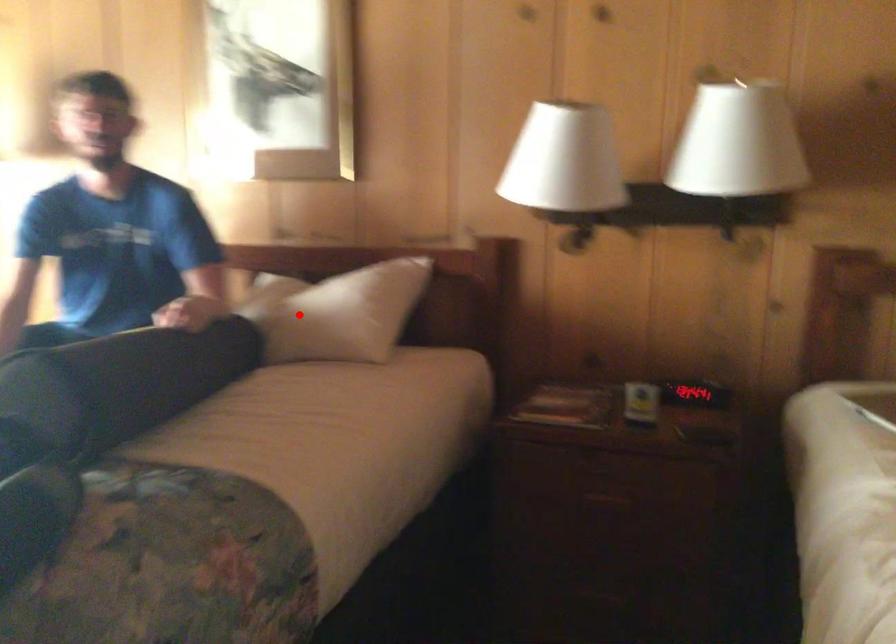
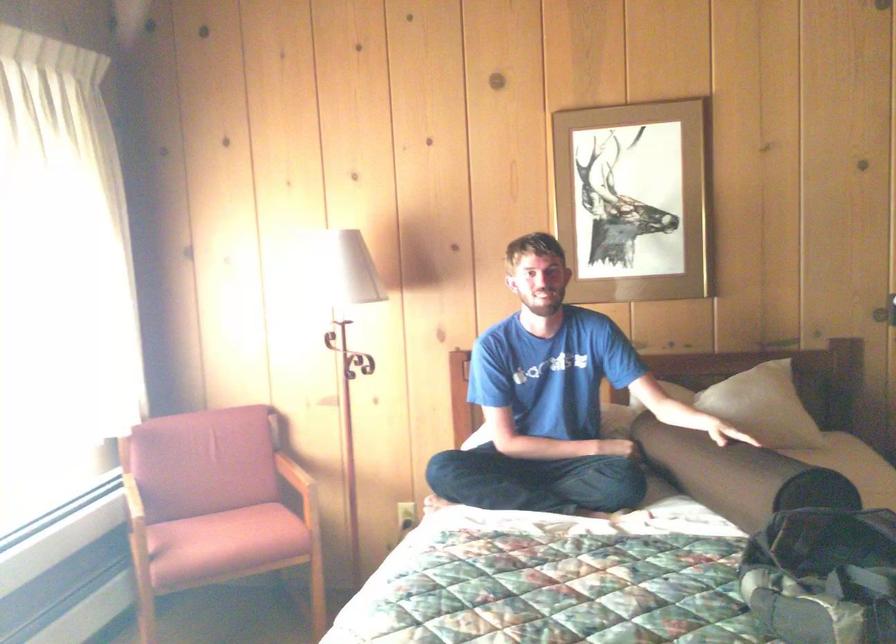
Question: I am providing you with two images of the same scene from different viewpoints. Given a red point in image1, look at the same physical point in image2. Is it:

Choices:
 (A) Closer to the viewpoint
 (B) Farther from the viewpoint

Answer: (B)